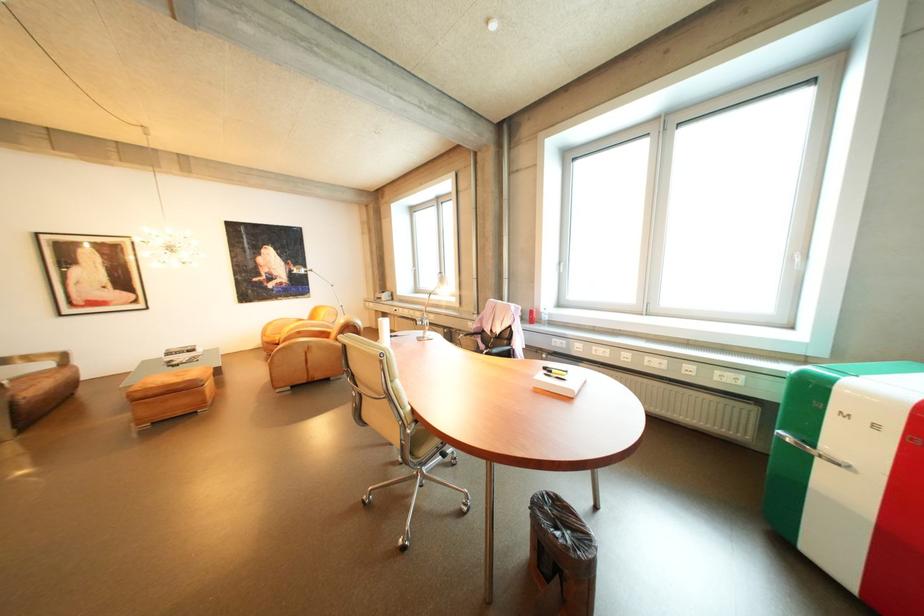
Where is `small trash can`? small trash can is located at coordinates (563, 552).